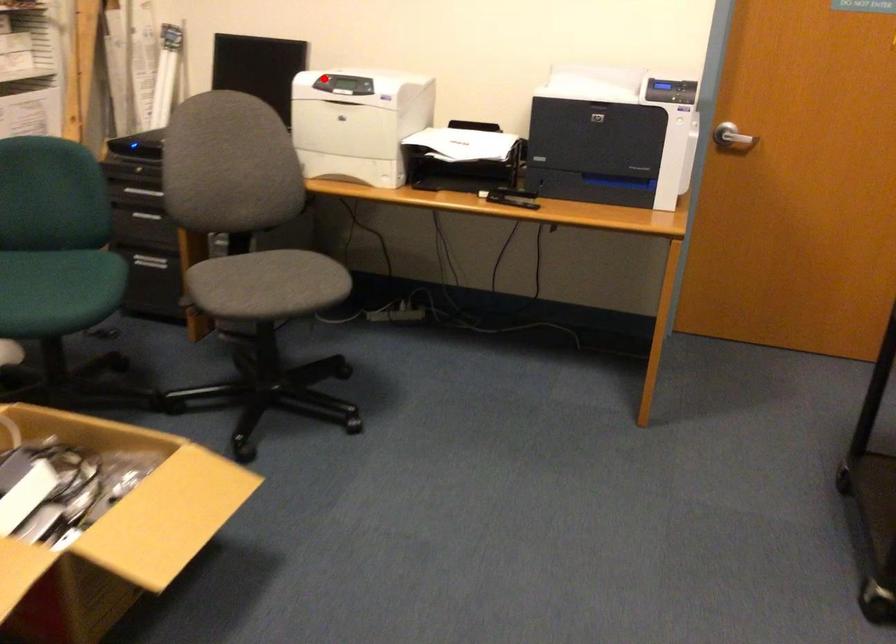
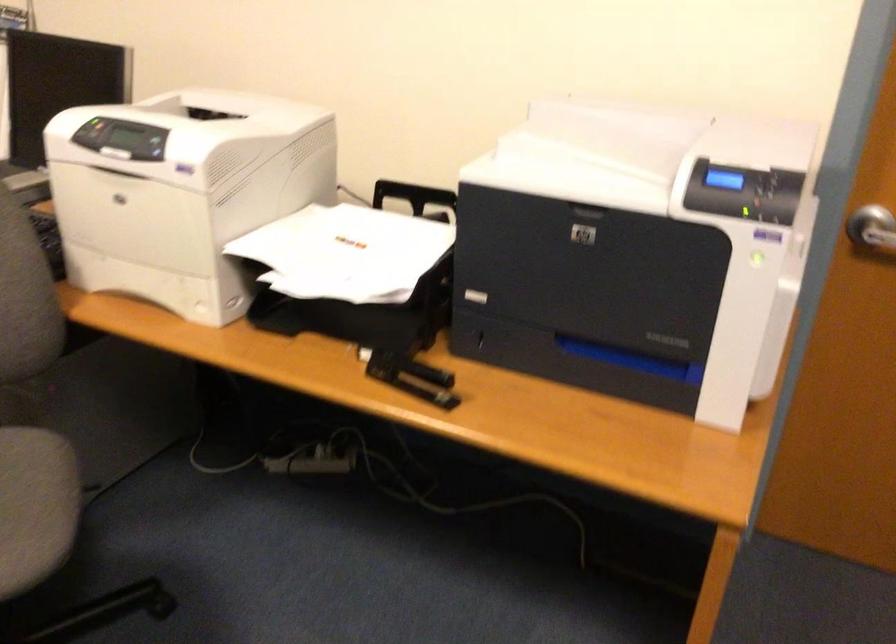
Where in the second image is the point corresponding to the highlighted location from the first image?

(91, 131)